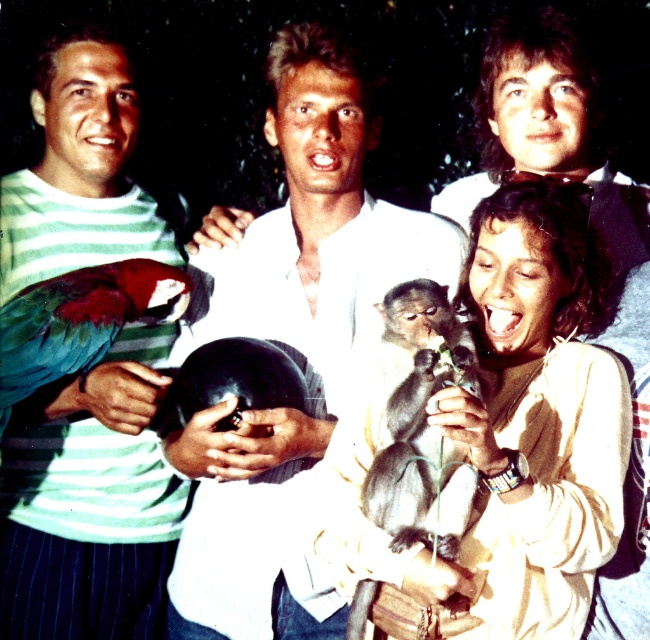
Does white matte shirt at center have a lesser height compared to dark gray furry monkey at center?

In fact, white matte shirt at center may be taller than dark gray furry monkey at center.

The height and width of the screenshot is (640, 650). I want to click on white matte shirt at center, so click(291, 337).

Is white matte shirt at center wider than green matte parrot at left?

Indeed, white matte shirt at center has a greater width compared to green matte parrot at left.

Does white matte shirt at center appear over green matte parrot at left?

Incorrect, white matte shirt at center is not positioned above green matte parrot at left.

Who is more forward, (302, 557) or (27, 324)?

Point (27, 324) is more forward.

The width and height of the screenshot is (650, 640). Identify the location of white matte shirt at center. (291, 337).

In the scene shown: Who is taller, smooth beige sweater at center or green matte parrot at left?

With more height is smooth beige sweater at center.

Measure the distance from smooth beige sweater at center to green matte parrot at left.

The distance of smooth beige sweater at center from green matte parrot at left is 29.82 inches.

Who is more distant from viewer, (484, 480) or (36, 332)?

Positioned behind is point (36, 332).

I want to click on smooth beige sweater at center, so (x=538, y=404).